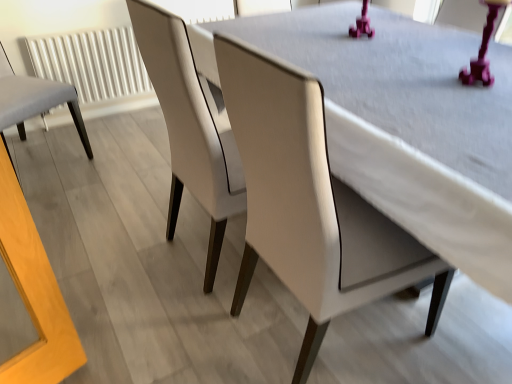
Question: Does white textured radiator at left have a larger size compared to light gray fabric chair at left, the 1th chair in the left-to-right sequence?

Choices:
 (A) no
 (B) yes

Answer: (A)

Question: Is white textured radiator at left oriented towards light gray fabric chair at left, the 1th chair in the left-to-right sequence?

Choices:
 (A) no
 (B) yes

Answer: (B)

Question: From the image's perspective, is white textured radiator at left located above light gray fabric chair at left, which appears as the third chair when viewed from the right?

Choices:
 (A) no
 (B) yes

Answer: (B)

Question: From a real-world perspective, is white textured radiator at left below light gray fabric chair at left, which appears as the third chair when viewed from the right?

Choices:
 (A) no
 (B) yes

Answer: (B)

Question: Does white textured radiator at left come in front of light gray fabric chair at left, the 1th chair in the left-to-right sequence?

Choices:
 (A) no
 (B) yes

Answer: (A)

Question: From the image's perspective, is matte white chair at center, arranged as the 2th chair when viewed from the left, located above or below white leather chair at center, positioned as the third chair in left-to-right order?

Choices:
 (A) below
 (B) above

Answer: (B)

Question: Is matte white chair at center, placed as the second chair when sorted from right to left, taller or shorter than white leather chair at center, the 1th chair in the right-to-left sequence?

Choices:
 (A) short
 (B) tall

Answer: (B)

Question: Considering their positions, is matte white chair at center, placed as the second chair when sorted from right to left, located in front of or behind white leather chair at center, positioned as the third chair in left-to-right order?

Choices:
 (A) behind
 (B) front

Answer: (A)

Question: Looking at their shapes, would you say matte white chair at center, placed as the second chair when sorted from right to left, is wider or thinner than white leather chair at center, the 1th chair in the right-to-left sequence?

Choices:
 (A) wide
 (B) thin

Answer: (B)

Question: Based on their positions, is white textured radiator at left located to the left or right of matte white chair at center, arranged as the 2th chair when viewed from the left?

Choices:
 (A) left
 (B) right

Answer: (A)

Question: Is white textured radiator at left taller or shorter than matte white chair at center, arranged as the 2th chair when viewed from the left?

Choices:
 (A) tall
 (B) short

Answer: (B)

Question: In terms of width, does white textured radiator at left look wider or thinner when compared to matte white chair at center, arranged as the 2th chair when viewed from the left?

Choices:
 (A) wide
 (B) thin

Answer: (B)

Question: Does point (115, 49) appear closer or farther from the camera than point (143, 44)?

Choices:
 (A) closer
 (B) farther

Answer: (B)

Question: Considering the positions of light gray fabric chair at left, the 1th chair in the left-to-right sequence, and matte white chair at center, placed as the second chair when sorted from right to left, in the image, is light gray fabric chair at left, the 1th chair in the left-to-right sequence, wider or thinner than matte white chair at center, placed as the second chair when sorted from right to left,?

Choices:
 (A) wide
 (B) thin

Answer: (A)

Question: In the image, is light gray fabric chair at left, the 1th chair in the left-to-right sequence, on the left side or the right side of matte white chair at center, arranged as the 2th chair when viewed from the left?

Choices:
 (A) left
 (B) right

Answer: (A)